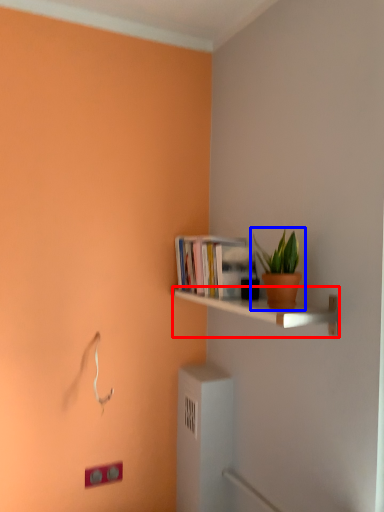
Question: Which point is closer to the camera, shelf (highlighted by a red box) or houseplant (highlighted by a blue box)?

Choices:
 (A) shelf
 (B) houseplant

Answer: (A)